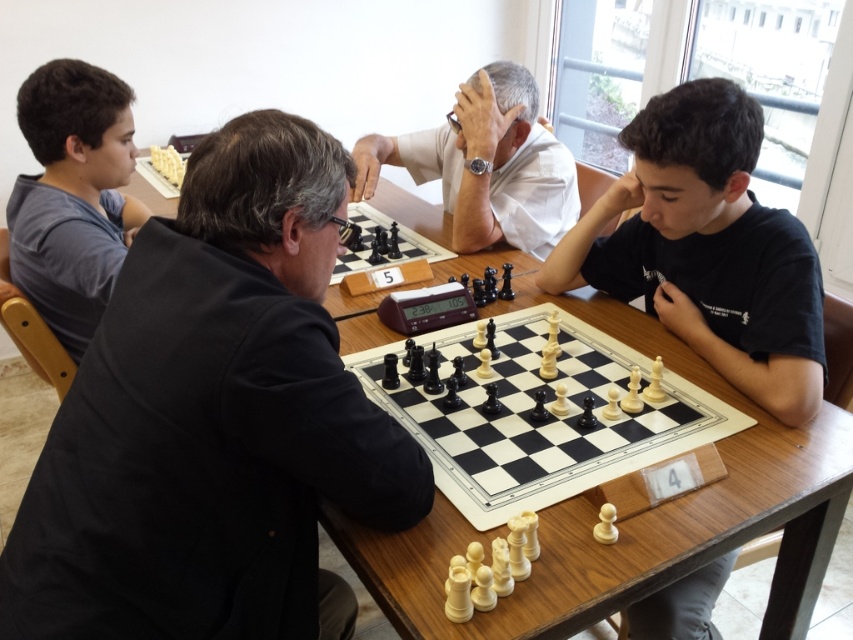
You are a photographer standing in front of the chess table. You want to take a photo of the gray cotton shirt at left and the white smooth shirt at center. Which shirt will appear larger in the photo?

The gray cotton shirt at left is closer to the viewer than the white smooth shirt at center, so it will appear larger in the photo.

You are a player sitting at the wooden chessboard at center. You need to move your knight to a position that is exactly 0.2 units to the right and 0.1 units above the current position. What are the new coordinates of the knight?

The new coordinates of the knight would be calculated by adding 0.2 to the x coordinate and 0.1 to the y coordinate of the wooden chessboard at center. Since the wooden chessboard at center is located at point (538, 420), the new coordinates would be 0.658 plus 0.2 equals 0.858 and 0.633 plus 0.1 equals 0.733. Therefore, the new coordinates are (624, 548).

You are a photographer trying to capture a clear shot of both the black fabric shirt at left and the gray cotton shirt at left. Since the camera can only focus on one subject at a time, which shirt should you choose to ensure the other is still somewhat in focus?

The black fabric shirt at left is larger in size than the gray cotton shirt at left, so focusing on the larger black fabric shirt at left would keep the smaller gray cotton shirt at left within the depth of field.